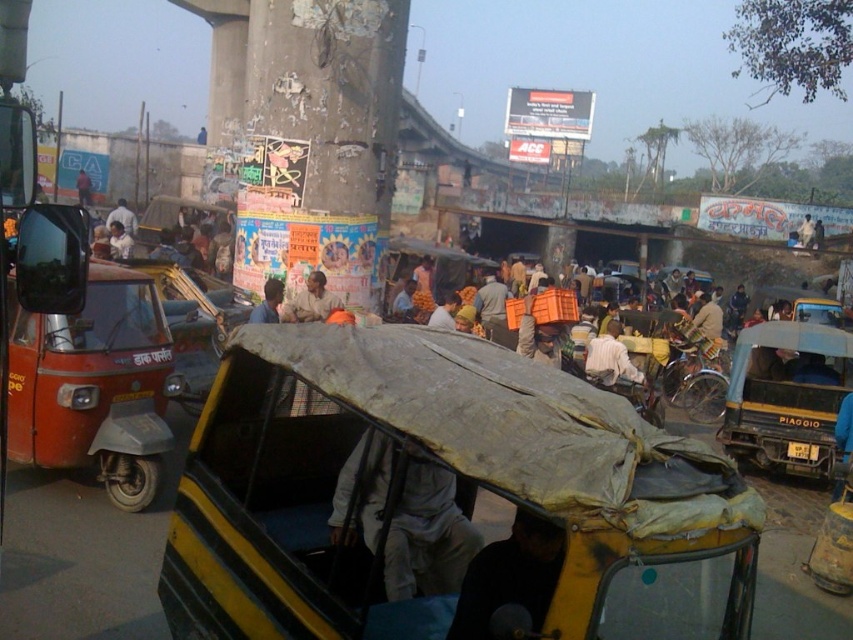
Question: Is yellow matte piaggio auto-rickshaw at right to the right of blue fabric at center from the viewer's perspective?

Choices:
 (A) yes
 (B) no

Answer: (A)

Question: Which object appears farthest from the camera in this image?

Choices:
 (A) orange fabric cloth at center
 (B) light brown fabric hat at upper center
 (C) light blue shirt at center

Answer: (B)

Question: Which object is closer to the camera taking this photo?

Choices:
 (A) light brown fabric hat at upper center
 (B) yellow fabric-covered auto-rickshaw at center

Answer: (B)

Question: Can you confirm if light brown fabric cloth at center is positioned below blue fabric at center?

Choices:
 (A) yes
 (B) no

Answer: (A)

Question: Does orange fabric cloth at center have a lesser width compared to light blue shirt at center?

Choices:
 (A) no
 (B) yes

Answer: (B)

Question: Which point is closer to the camera?

Choices:
 (A) light blue shirt at center
 (B) light gray fabric at center
 (C) light brown fabric hat at upper center

Answer: (B)